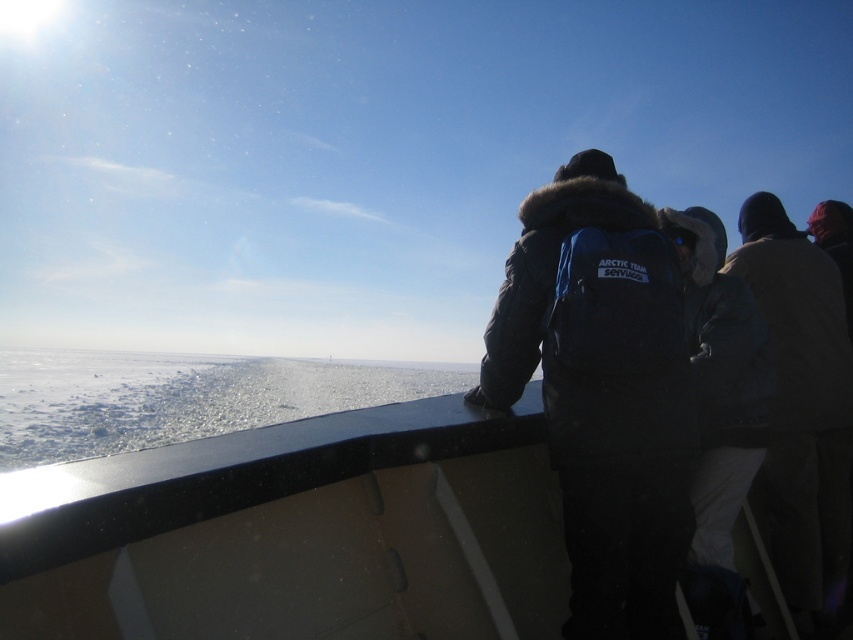
Between white ice at lower left and dark gray fur-lined jacket at center, which one has more height?

Standing taller between the two is white ice at lower left.

Is white ice at lower left further to camera compared to dark gray fur-lined jacket at center?

Yes, white ice at lower left is further from the viewer.

Does point (74, 364) come in front of point (701, 461)?

No.

In order to click on white ice at lower left in this screenshot , I will do `click(181, 397)`.

At what (x,y) coordinates should I click in order to perform the action: click on smooth black boat at center. Please return your answer as a coordinate pair (x, y). Image resolution: width=853 pixels, height=640 pixels. Looking at the image, I should click on (297, 532).

Who is more distant from viewer, (x=335, y=451) or (x=814, y=275)?

The point (x=814, y=275) is behind.

Describe the element at coordinates (297, 532) in the screenshot. I see `smooth black boat at center` at that location.

Image resolution: width=853 pixels, height=640 pixels. Find the location of `smooth black boat at center`. smooth black boat at center is located at coordinates (297, 532).

Can you confirm if smooth black boat at center is positioned to the right of white ice at lower left?

Correct, you'll find smooth black boat at center to the right of white ice at lower left.

Is smooth black boat at center to the left of white ice at lower left from the viewer's perspective?

No, smooth black boat at center is not to the left of white ice at lower left.

Where is `smooth black boat at center`? The width and height of the screenshot is (853, 640). smooth black boat at center is located at coordinates (297, 532).

The width and height of the screenshot is (853, 640). What are the coordinates of `smooth black boat at center` in the screenshot? It's located at (297, 532).